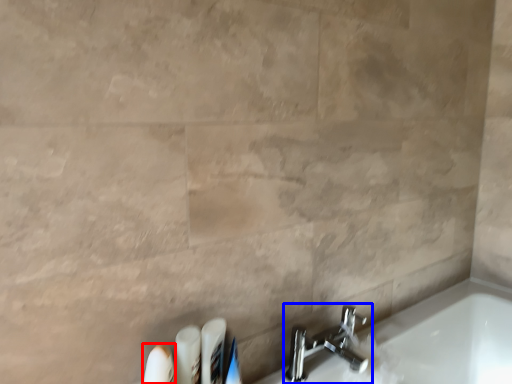
Question: Which object appears farthest to the camera in this image, toiletry (highlighted by a red box) or tap (highlighted by a blue box)?

Choices:
 (A) toiletry
 (B) tap

Answer: (B)